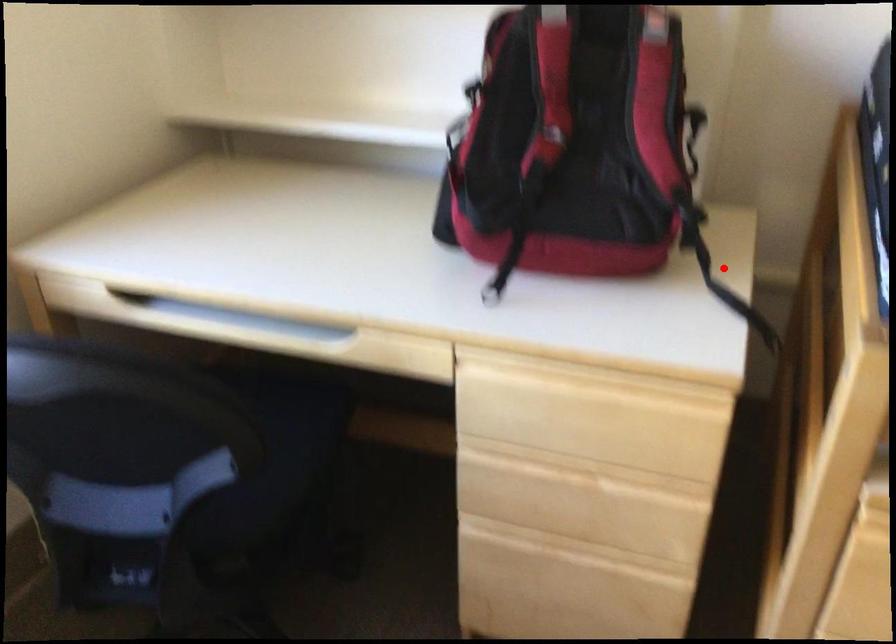
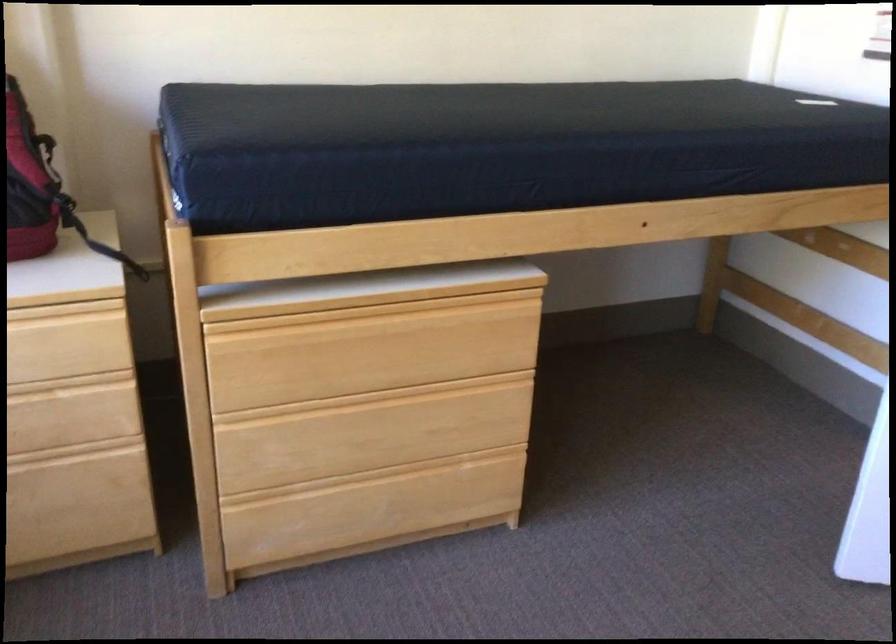
Find the pixel in the second image that matches the highlighted location in the first image.

(101, 245)